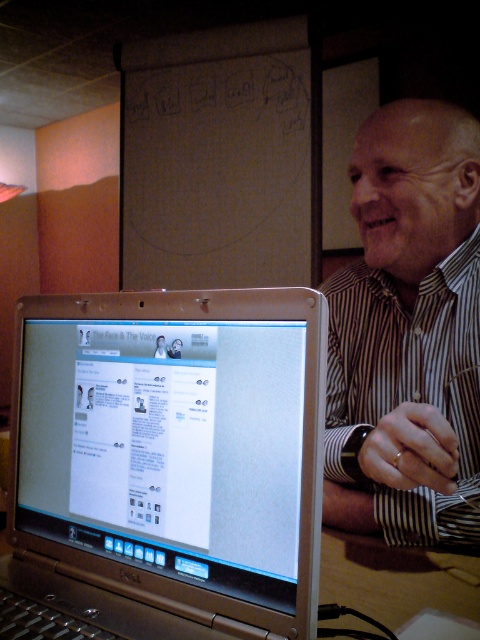
Question: Does silver metallic laptop at center lie behind striped shirt at right?

Choices:
 (A) no
 (B) yes

Answer: (A)

Question: Which of the following is the closest to the observer?

Choices:
 (A) striped shirt at right
 (B) silver metallic laptop at center

Answer: (B)

Question: Is silver metallic laptop at center thinner than striped shirt at right?

Choices:
 (A) no
 (B) yes

Answer: (A)

Question: Is silver metallic laptop at center to the right of striped shirt at right from the viewer's perspective?

Choices:
 (A) yes
 (B) no

Answer: (B)

Question: Among these points, which one is farthest from the camera?

Choices:
 (A) (431, 362)
 (B) (116, 422)

Answer: (A)